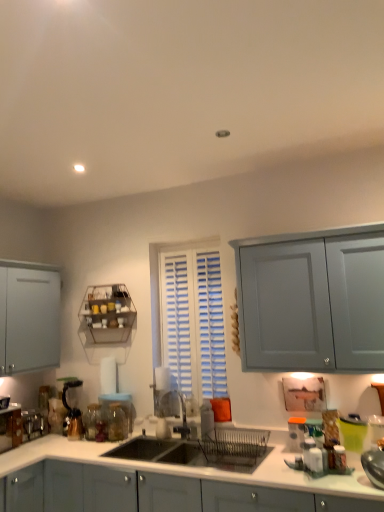
Question: Should I look upward or downward to see white glossy salt shaker at lower right, the first appliance viewed from the front?

Choices:
 (A) down
 (B) up

Answer: (A)

Question: Can you confirm if matte black coffee machine at lower left is shorter than matte gray cabinets at center?

Choices:
 (A) yes
 (B) no

Answer: (A)

Question: From the image's perspective, is matte black coffee machine at lower left below matte gray cabinets at center?

Choices:
 (A) yes
 (B) no

Answer: (B)

Question: Is matte black coffee machine at lower left to the right of matte gray cabinets at center from the viewer's perspective?

Choices:
 (A) no
 (B) yes

Answer: (A)

Question: Is matte black coffee machine at lower left positioned behind matte gray cabinets at center?

Choices:
 (A) yes
 (B) no

Answer: (A)

Question: From the image's perspective, is matte black coffee machine at lower left over matte gray cabinets at center?

Choices:
 (A) yes
 (B) no

Answer: (A)

Question: Considering the relative positions of matte black coffee machine at lower left and matte gray cabinets at center in the image provided, is matte black coffee machine at lower left to the left of matte gray cabinets at center from the viewer's perspective?

Choices:
 (A) yes
 (B) no

Answer: (A)

Question: Does metallic silver toaster at lower left, which is the 1th appliance in left-to-right order, have a greater width compared to transparent glass jar at sink, the second glass jar positioned from the left?

Choices:
 (A) no
 (B) yes

Answer: (A)

Question: Considering the relative positions of metallic silver toaster at lower left, the third appliance positioned from the front, and transparent glass jar at sink, the 1th glass jar viewed from the right, in the image provided, is metallic silver toaster at lower left, the third appliance positioned from the front, to the left of transparent glass jar at sink, the 1th glass jar viewed from the right, from the viewer's perspective?

Choices:
 (A) yes
 (B) no

Answer: (A)

Question: Is metallic silver toaster at lower left, which appears as the 1th appliance when viewed from the back, to the right of transparent glass jar at sink, the second glass jar positioned from the left, from the viewer's perspective?

Choices:
 (A) no
 (B) yes

Answer: (A)

Question: Is metallic silver toaster at lower left, the third appliance positioned from the front, thinner than transparent glass jar at sink, the 1th glass jar viewed from the right?

Choices:
 (A) yes
 (B) no

Answer: (A)

Question: Is metallic silver toaster at lower left, the third appliance positioned from the front, smaller than transparent glass jar at sink, the second glass jar positioned from the left?

Choices:
 (A) yes
 (B) no

Answer: (B)

Question: Is metallic silver toaster at lower left, which is the 3th appliance in right-to-left order, next to transparent glass jar at sink, the second glass jar positioned from the left?

Choices:
 (A) yes
 (B) no

Answer: (B)

Question: Would you say transparent glass jar at sink, the 1th glass jar viewed from the right, contains metallic wire rack at upper left?

Choices:
 (A) yes
 (B) no

Answer: (B)